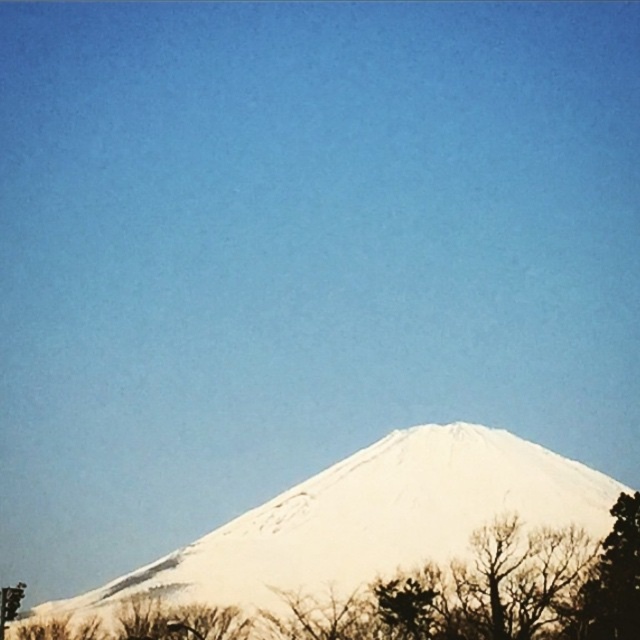
Question: Which point is farther from the camera taking this photo?

Choices:
 (A) (621, 531)
 (B) (284, 525)

Answer: (B)

Question: Does white snow-covered mountain at center have a smaller size compared to green leafy tree at lower right?

Choices:
 (A) yes
 (B) no

Answer: (B)

Question: Among these points, which one is nearest to the camera?

Choices:
 (A) (385, 449)
 (B) (611, 560)

Answer: (B)

Question: Does white snow-covered mountain at center appear on the right side of green leafy tree at lower right?

Choices:
 (A) yes
 (B) no

Answer: (B)

Question: Does white snow-covered mountain at center have a larger size compared to green leafy tree at lower right?

Choices:
 (A) no
 (B) yes

Answer: (B)

Question: Which of the following is the closest to the observer?

Choices:
 (A) green leafy tree at lower right
 (B) white snow-covered mountain at center

Answer: (A)